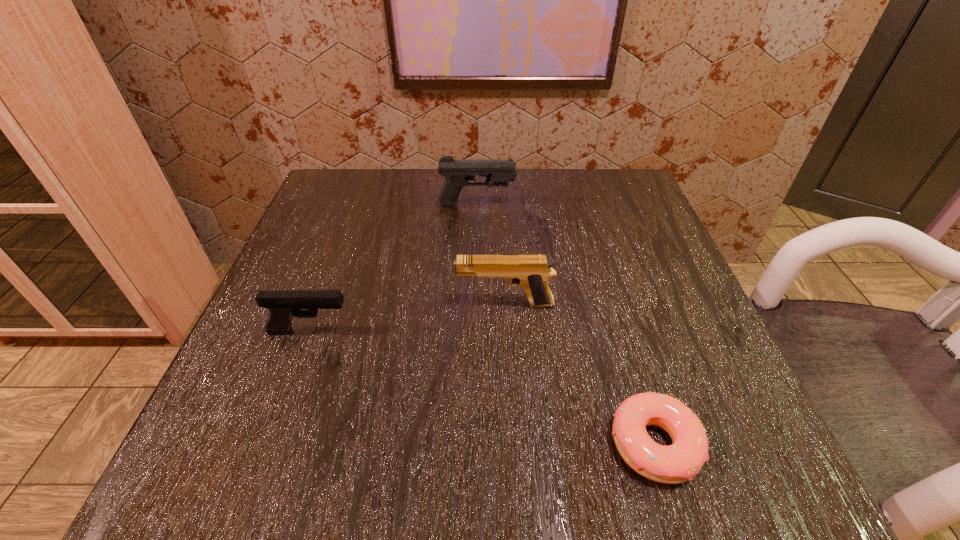
You are a GUI agent. You are given a task and a screenshot of the screen. Output one action in this format:
    pyautogui.click(x=<x>, y=<y>)
    Task: Click on the free space that satisfies the following two spatial constraints: 1. on the front-facing side of the leftmost object; 2. on the left side of the doughnut
    Image resolution: width=960 pixels, height=540 pixels.
    Given the screenshot: What is the action you would take?
    pyautogui.click(x=270, y=444)

Image resolution: width=960 pixels, height=540 pixels. I want to click on free region that satisfies the following two spatial constraints: 1. on the front-facing side of the leftmost pistol; 2. on the back side of the doughnut, so click(x=270, y=444).